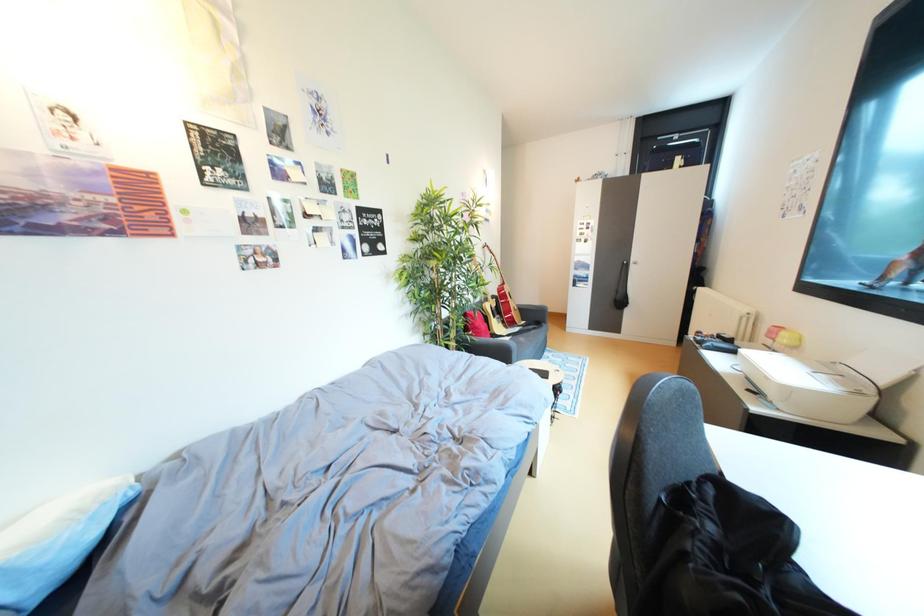
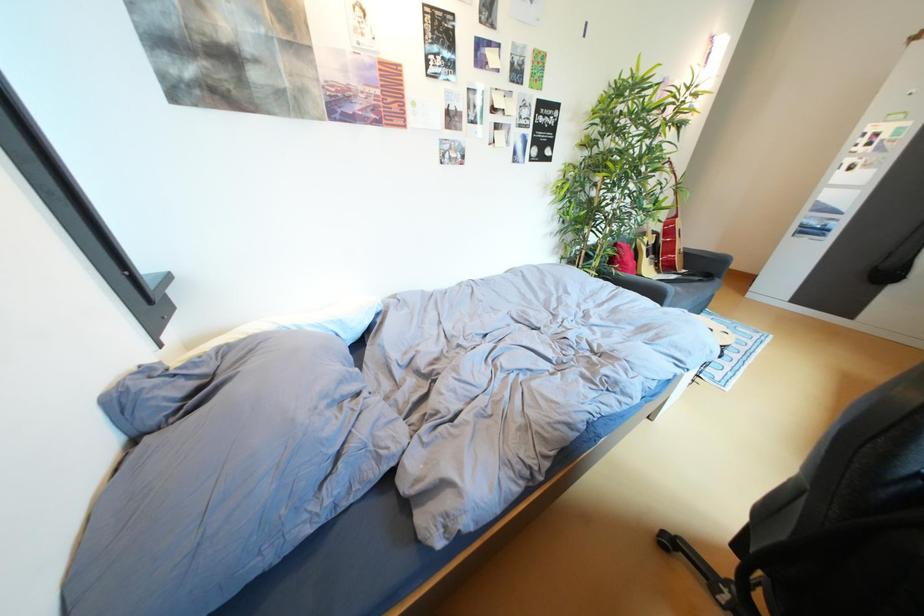
Based on the continuous images, in which direction is the camera rotating?

The camera's rotation is toward left-down.